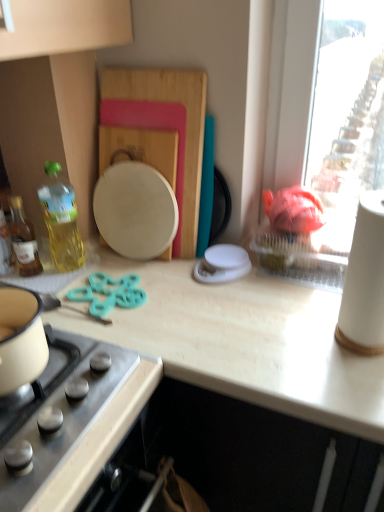
The height and width of the screenshot is (512, 384). Identify the location of free point behind teal plastic scissors at center. (114, 262).